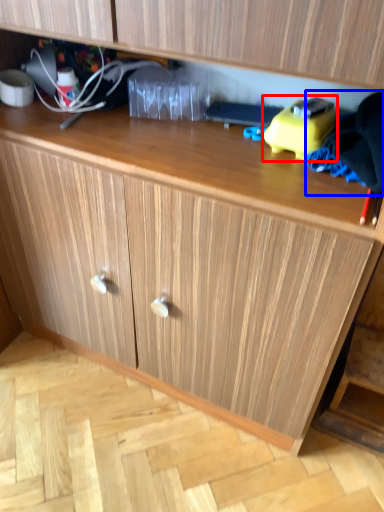
Question: Which object is closer to the camera taking this photo, toy (highlighted by a red box) or clothing (highlighted by a blue box)?

Choices:
 (A) toy
 (B) clothing

Answer: (B)